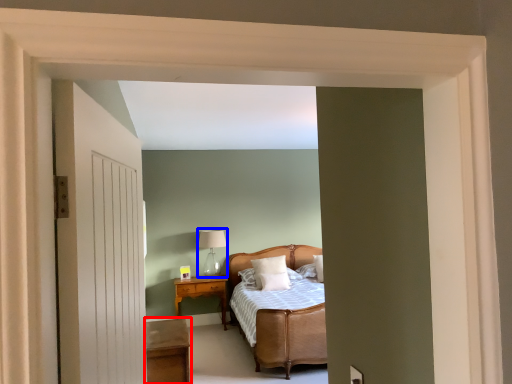
Question: Which of the following is the farthest to the observer, table (highlighted by a red box) or table lamp (highlighted by a blue box)?

Choices:
 (A) table
 (B) table lamp

Answer: (B)